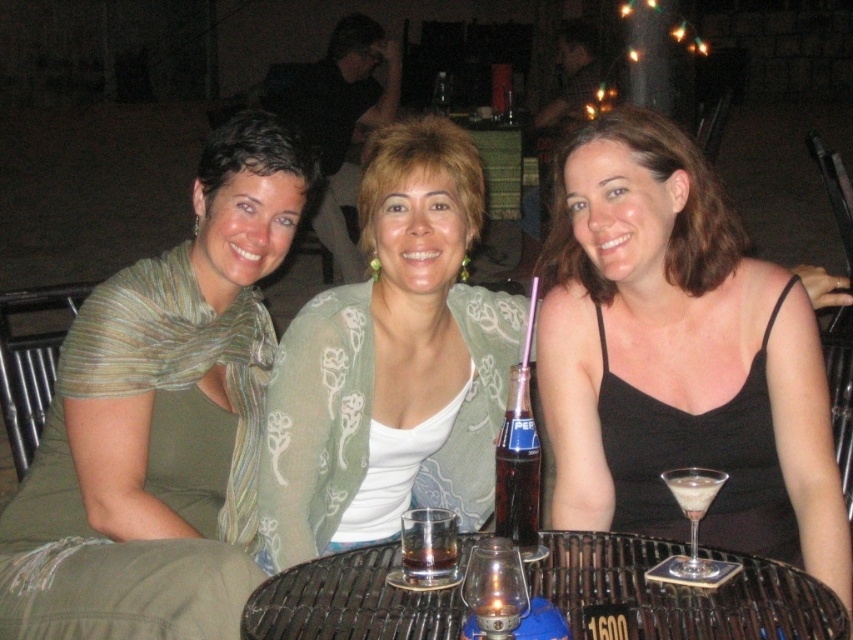
You are a photographer at the scene and want to take a closeup of the green textured scarf at center. Where should you position your camera to capture it?

The green textured scarf at center is located at point (161, 420), so position the camera at that coordinate to capture it.

Based on the photo, you are a photographer trying to capture a closeup of the green textured scarf at center. Based on its position, where should you aim your camera?

The green textured scarf at center is located at point 0.659 on the x axis and 0.190 on the y axis, so you should aim your camera at those coordinates to capture it.